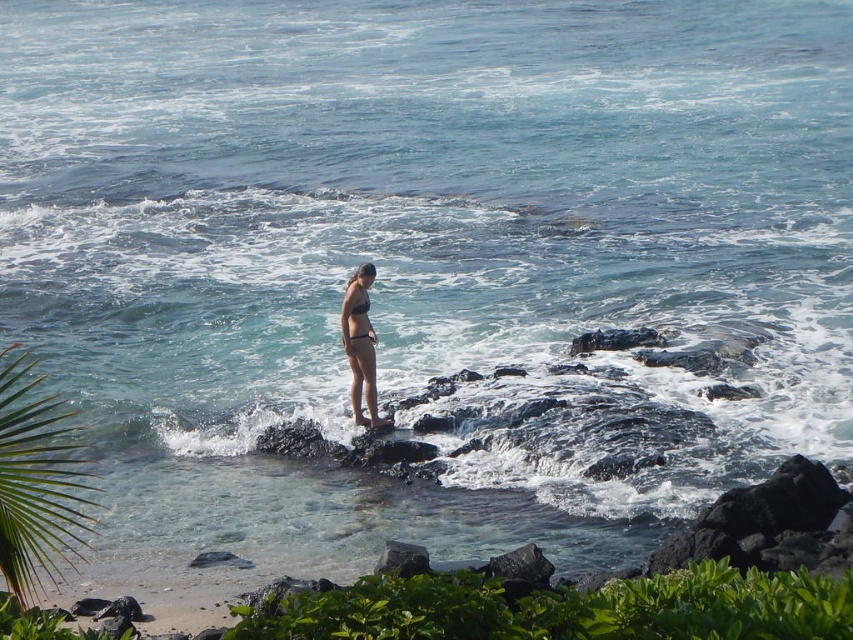
You are a photographer trying to capture the perfect shot of the matte black bikini top at center and the smooth gray rock at lower center. To ensure both subjects are in frame, which direction should you move your camera to align them properly?

Since the smooth gray rock at lower center is to the right of the matte black bikini top at center, you should move your camera slightly to the right to include both subjects in the frame.

You are a photographer positioned at the camera. You want to take a photo of the matte black bikini at center. However, you notice that the subject is too far away. What is the minimum distance you need to move closer to ensure the subject fills the frame adequately?

The matte black bikini at center is currently 17.87 meters away from the camera. To ensure the subject fills the frame adequately, you would need to move closer so that the distance is reduced to a suitable range for your camera lens. However, without knowing the specific focal length and sensor size of the camera, it is difficult to provide an exact minimum distance. Generally, for a full frame camera with a 50mm lens, a distance of around 3 to 5 meters might be more appropriate. Adjust your position based